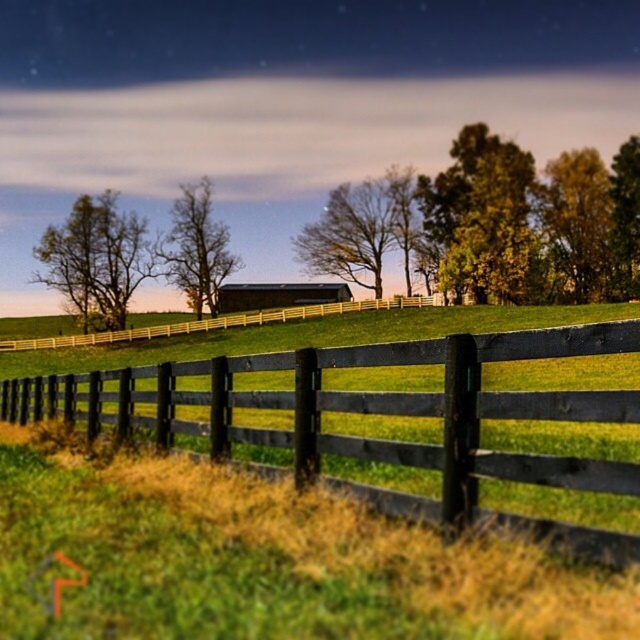
You are standing at the base of the hill and see two points marked in the image. Which point is closer to you, point [324,314] or point [320,285]?

Point [324,314] is in front of point [320,285], so it is closer to you.